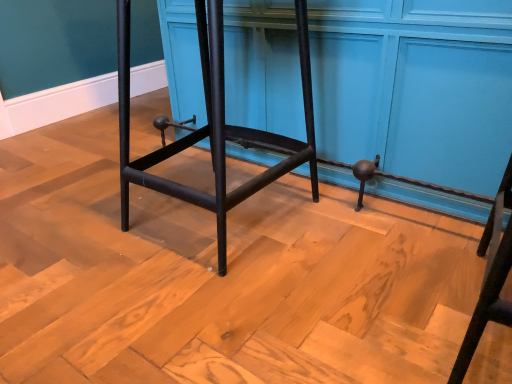
In the scene shown: Measure the distance between black metal stool at center and camera.

The distance of black metal stool at center from camera is 36.14 inches.

The width and height of the screenshot is (512, 384). What do you see at coordinates (212, 125) in the screenshot? I see `black metal stool at center` at bounding box center [212, 125].

This screenshot has height=384, width=512. What are the coordinates of `black metal stool at center` in the screenshot? It's located at (212, 125).

Where is `black metal stool at center`? This screenshot has height=384, width=512. black metal stool at center is located at coordinates (212, 125).